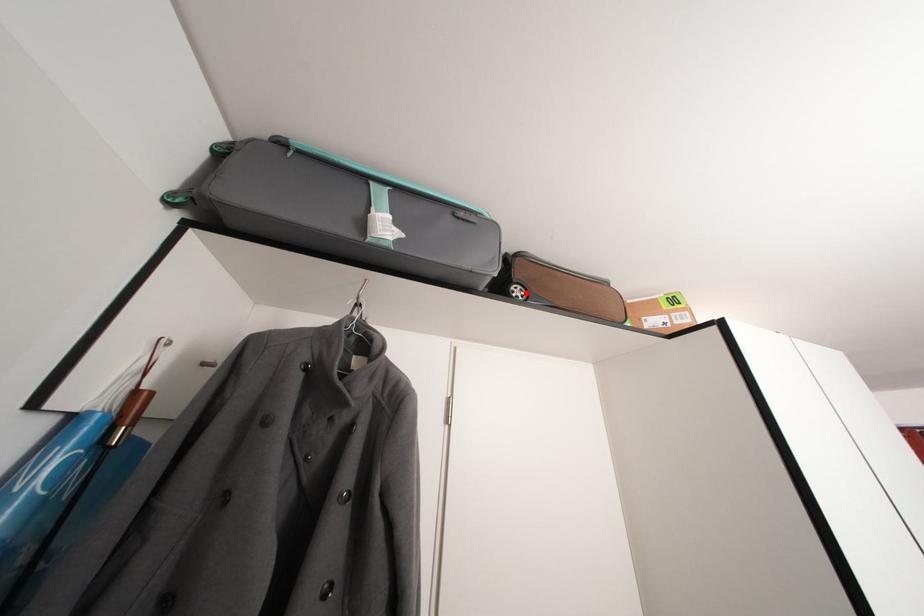
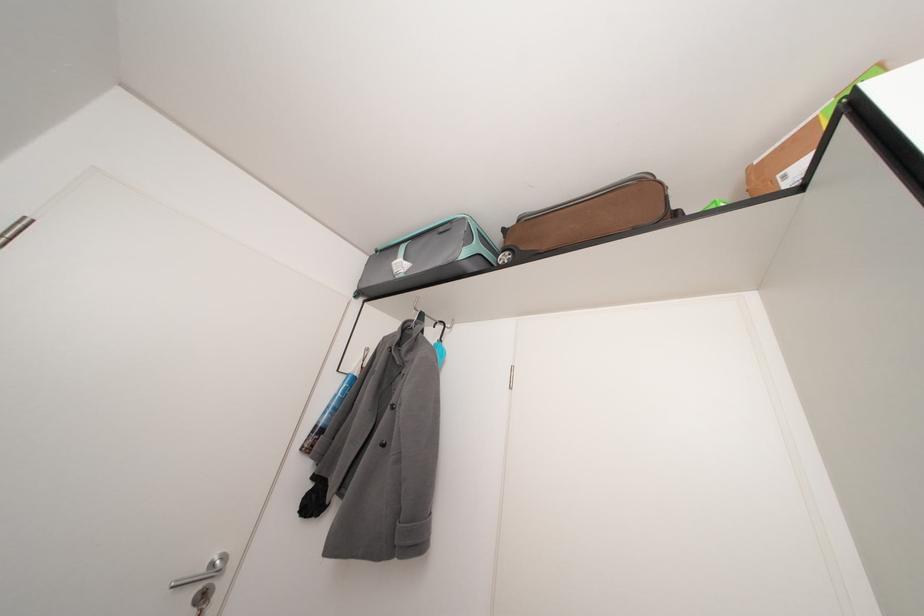
The point at the highlighted location is marked in the first image. Where is the corresponding point in the second image?

(514, 257)